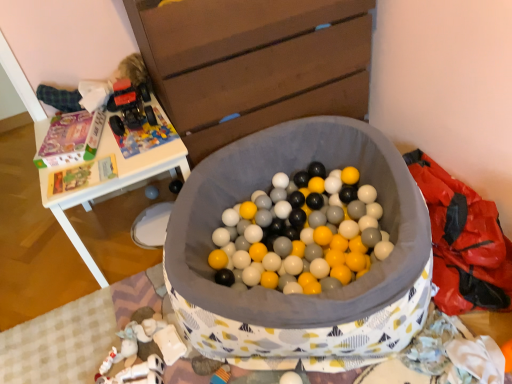
Question: Does white plastic table at upper left have a greater width compared to wooden chest of drawers at upper center?

Choices:
 (A) no
 (B) yes

Answer: (B)

Question: Is white plastic table at upper left taller than wooden chest of drawers at upper center?

Choices:
 (A) no
 (B) yes

Answer: (A)

Question: Does white plastic table at upper left come in front of wooden chest of drawers at upper center?

Choices:
 (A) yes
 (B) no

Answer: (B)

Question: From the image's perspective, is white plastic table at upper left under wooden chest of drawers at upper center?

Choices:
 (A) no
 (B) yes

Answer: (B)

Question: From the image's perspective, is white plastic table at upper left located above wooden chest of drawers at upper center?

Choices:
 (A) no
 (B) yes

Answer: (A)

Question: From a real-world perspective, does white plastic table at upper left sit lower than wooden chest of drawers at upper center?

Choices:
 (A) yes
 (B) no

Answer: (A)

Question: From the image's perspective, is wooden chest of drawers at upper center on white plastic table at upper left?

Choices:
 (A) no
 (B) yes

Answer: (B)

Question: Does wooden chest of drawers at upper center have a lesser width compared to white plastic table at upper left?

Choices:
 (A) yes
 (B) no

Answer: (A)

Question: Is wooden chest of drawers at upper center shorter than white plastic table at upper left?

Choices:
 (A) yes
 (B) no

Answer: (B)

Question: Is wooden chest of drawers at upper center outside white plastic table at upper left?

Choices:
 (A) no
 (B) yes

Answer: (B)

Question: Considering the relative sizes of wooden chest of drawers at upper center and white plastic table at upper left in the image provided, is wooden chest of drawers at upper center bigger than white plastic table at upper left?

Choices:
 (A) yes
 (B) no

Answer: (A)

Question: Is wooden chest of drawers at upper center further to camera compared to white plastic table at upper left?

Choices:
 (A) yes
 (B) no

Answer: (B)

Question: From a real-world perspective, relative to white plastic table at upper left, is wooden chest of drawers at upper center vertically above or below?

Choices:
 (A) above
 (B) below

Answer: (A)